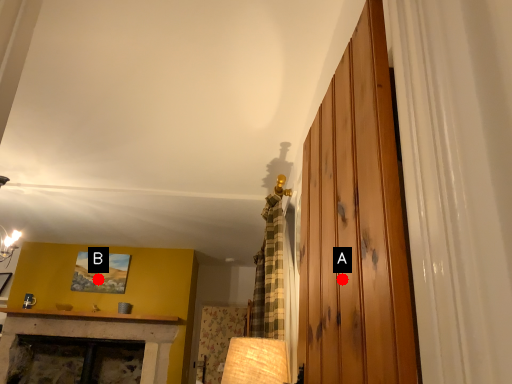
Question: Two points are circled on the image, labeled by A and B beside each circle. Which point is farther from the camera taking this photo?

Choices:
 (A) A is further
 (B) B is further

Answer: (B)